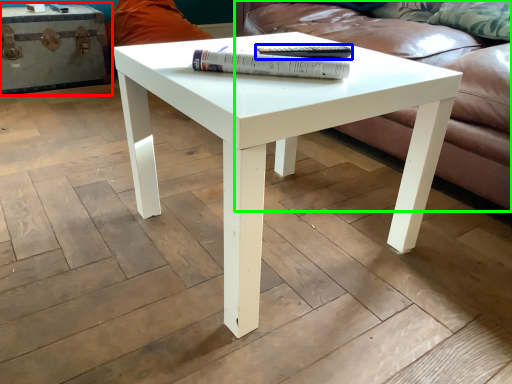
Question: Which is nearer to the chest (highlighted by a red box)? paperback book (highlighted by a blue box) or studio couch (highlighted by a green box).

Choices:
 (A) paperback book
 (B) studio couch

Answer: (B)